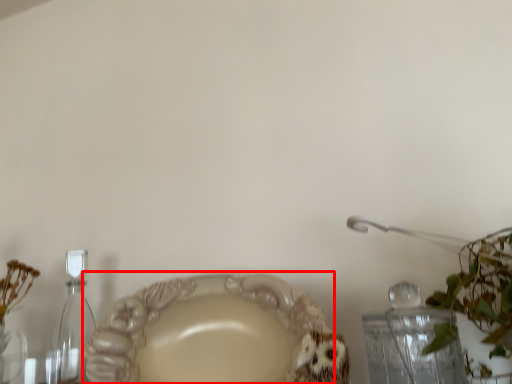
Question: From the image's perspective, what is the correct spatial positioning of plate (annotated by the red box) in reference to bottle?

Choices:
 (A) below
 (B) above

Answer: (B)